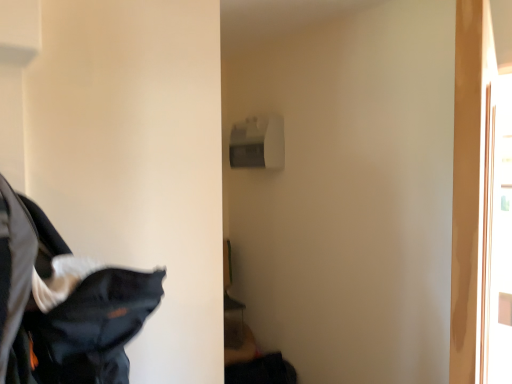
Question: Do you think transparent glass screen door at right is within dark blue fabric at lower left, or outside of it?

Choices:
 (A) outside
 (B) inside

Answer: (A)

Question: From a real-world perspective, is transparent glass screen door at right physically located above or below dark blue fabric at lower left?

Choices:
 (A) above
 (B) below

Answer: (A)

Question: Considering the positions of transparent glass screen door at right and dark blue fabric at lower left in the image, is transparent glass screen door at right wider or thinner than dark blue fabric at lower left?

Choices:
 (A) thin
 (B) wide

Answer: (A)

Question: Is dark blue fabric at lower left wider or thinner than transparent glass screen door at right?

Choices:
 (A) thin
 (B) wide

Answer: (B)

Question: Considering the positions of dark blue fabric at lower left and transparent glass screen door at right in the image, is dark blue fabric at lower left taller or shorter than transparent glass screen door at right?

Choices:
 (A) tall
 (B) short

Answer: (B)

Question: In the image, is dark blue fabric at lower left on the left side or the right side of transparent glass screen door at right?

Choices:
 (A) left
 (B) right

Answer: (A)

Question: Would you say dark blue fabric at lower left is inside or outside transparent glass screen door at right?

Choices:
 (A) outside
 (B) inside

Answer: (A)